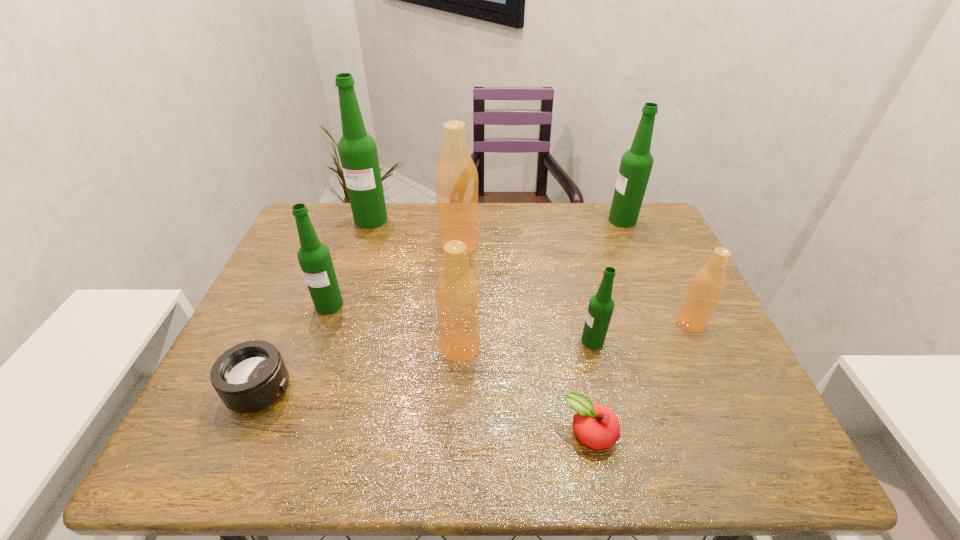
This screenshot has width=960, height=540. I want to click on vacant region that satisfies the following two spatial constraints: 1. on the label of the tallest object; 2. on the right side of the smallest tan beer bottle, so click(x=338, y=322).

The height and width of the screenshot is (540, 960). In order to click on free space that satisfies the following two spatial constraints: 1. on the label of the apple; 2. on the right side of the third biggest green beer bottle in this screenshot , I will do `click(283, 434)`.

Locate an element on the screen. The width and height of the screenshot is (960, 540). vacant space that satisfies the following two spatial constraints: 1. on the front side of the second biggest tan beer bottle; 2. on the right side of the biggest tan beer bottle is located at coordinates (453, 347).

What are the coordinates of `vacant position in the image that satisfies the following two spatial constraints: 1. on the side of the telephoto lens with brand markings and control switches; 2. on the right side of the apple` in the screenshot? It's located at (241, 434).

What are the coordinates of `free spot that satisfies the following two spatial constraints: 1. on the label of the second biggest green beer bottle; 2. on the label of the second smallest green beer bottle` in the screenshot? It's located at (658, 305).